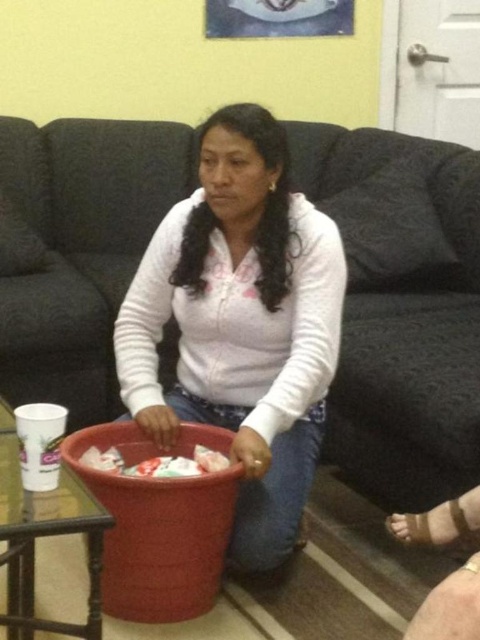
You are a guest in this living room and want to sit down on the white fleece at center. However, there is a dark fabric couch at center in the way. Can you move around the couch to reach the fleece?

The white fleece at center is behind the dark fabric couch at center, so you can move around the couch to reach the fleece.

You are standing in a room and want to reach the dark fabric couch at center. If your reach extends 1.5 meters, can you touch it without moving your feet?

The dark fabric couch at center is 1.56 meters away from the viewer. Since your reach only extends 1.5 meters, you cannot touch it without moving your feet.

Based on the photo, you are a delivery person who needs to place a small package between the dark fabric couch at center and the white fleece at center. The package is 10 inches long. Can you fit it in the space between them?

The space between the dark fabric couch at center and the white fleece at center is 20.58 inches, so yes, the 10 inch package can fit in the space between them.